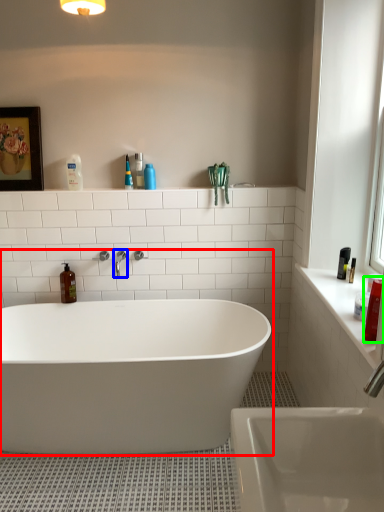
Question: Estimate the real-world distances between objects in this image. Which object is closer to bathtub (highlighted by a red box), tap (highlighted by a blue box) or cleaning product (highlighted by a green box)?

Choices:
 (A) tap
 (B) cleaning product

Answer: (A)